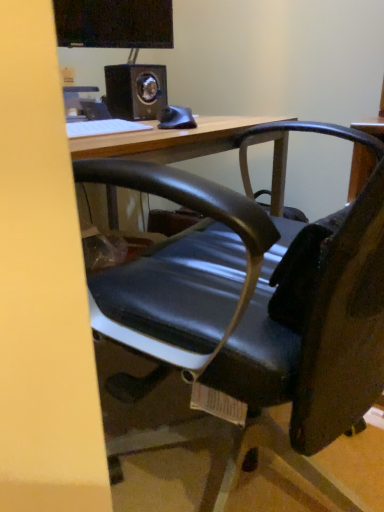
Question: Is metallic black speaker at upper center not within black glossy monitor at upper center?

Choices:
 (A) yes
 (B) no

Answer: (A)

Question: Does metallic black speaker at upper center have a smaller size compared to black glossy monitor at upper center?

Choices:
 (A) no
 (B) yes

Answer: (B)

Question: Does metallic black speaker at upper center have a greater height compared to black glossy monitor at upper center?

Choices:
 (A) yes
 (B) no

Answer: (B)

Question: Can you confirm if metallic black speaker at upper center is wider than black glossy monitor at upper center?

Choices:
 (A) yes
 (B) no

Answer: (A)

Question: Is metallic black speaker at upper center positioned with its back to black glossy monitor at upper center?

Choices:
 (A) yes
 (B) no

Answer: (B)

Question: Is metallic black speaker at upper center at the left side of black glossy monitor at upper center?

Choices:
 (A) no
 (B) yes

Answer: (A)

Question: From the image's perspective, does metallic black speaker at upper center appear higher than wooden desk at center?

Choices:
 (A) no
 (B) yes

Answer: (B)

Question: From a real-world perspective, is metallic black speaker at upper center on top of wooden desk at center?

Choices:
 (A) no
 (B) yes

Answer: (B)

Question: Would you say metallic black speaker at upper center is a long distance from wooden desk at center?

Choices:
 (A) yes
 (B) no

Answer: (B)

Question: Can you confirm if metallic black speaker at upper center is shorter than wooden desk at center?

Choices:
 (A) yes
 (B) no

Answer: (A)

Question: Considering the relative positions of metallic black speaker at upper center and wooden desk at center in the image provided, is metallic black speaker at upper center in front of wooden desk at center?

Choices:
 (A) no
 (B) yes

Answer: (A)

Question: Can you confirm if metallic black speaker at upper center is bigger than wooden desk at center?

Choices:
 (A) no
 (B) yes

Answer: (A)

Question: Is metallic black speaker at upper center positioned with its back to white matte keyboard at upper left?

Choices:
 (A) yes
 (B) no

Answer: (B)